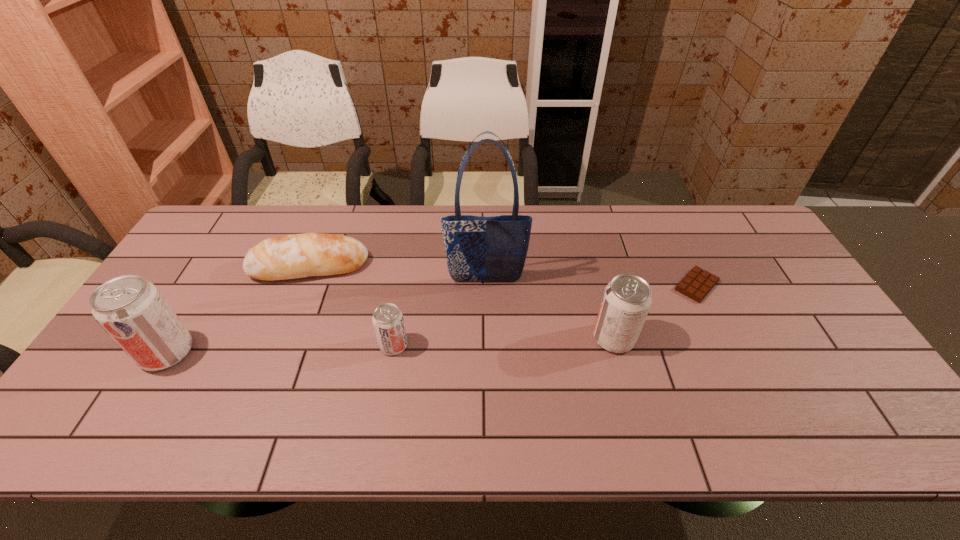
The image size is (960, 540). In order to click on the closest soda can to the leftmost soda can in this screenshot , I will do `click(388, 323)`.